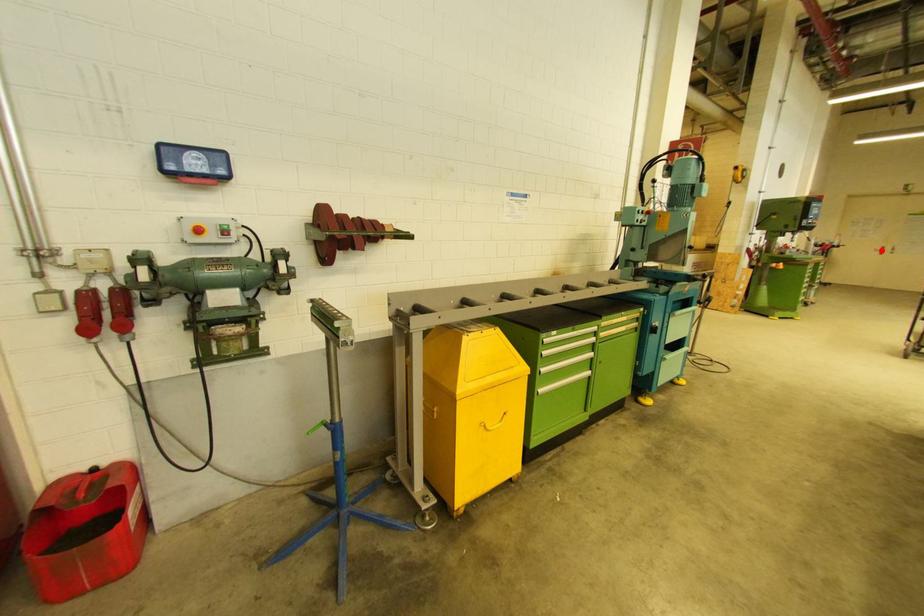
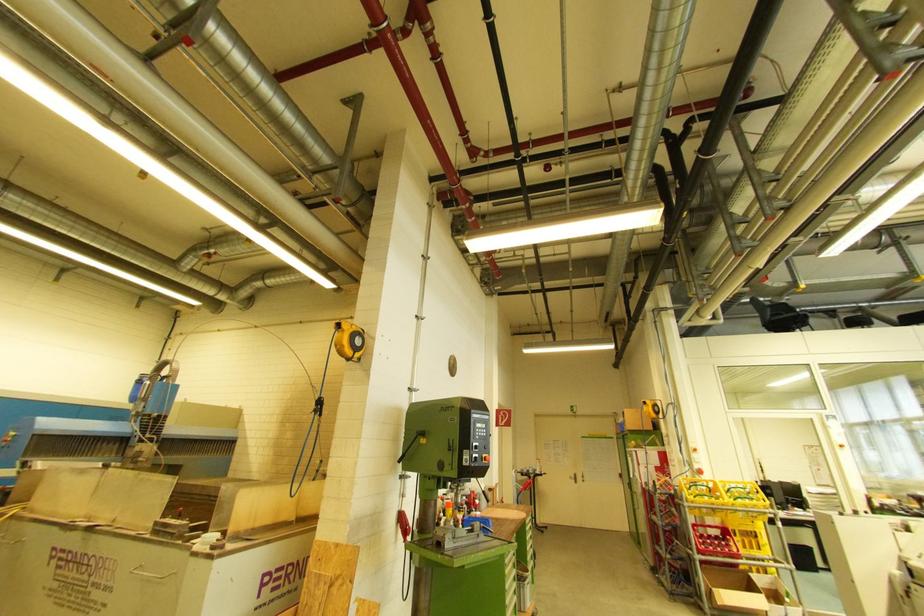
Find the pixel in the second image that matches the highlighted location in the first image.

(575, 477)